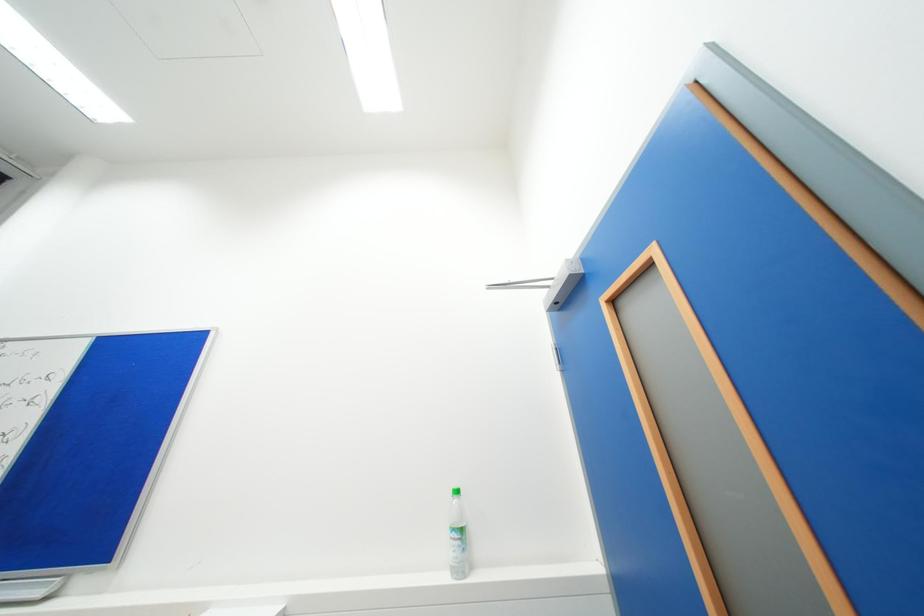
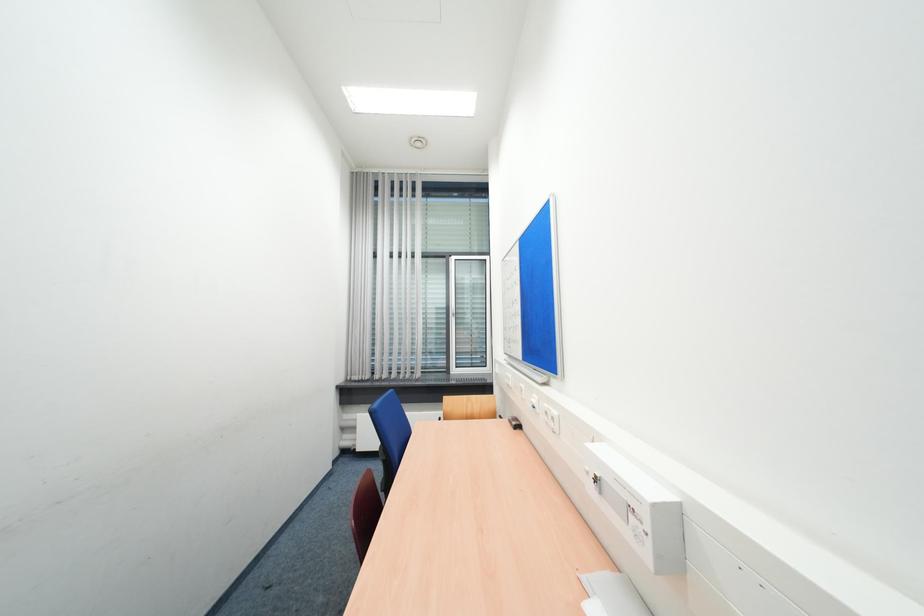
Question: Based on the continuous images, in which direction is the camera rotating? Reply with the corresponding letter.

Choices:
 (A) Left
 (B) Right
 (C) Up
 (D) Down

Answer: (A)